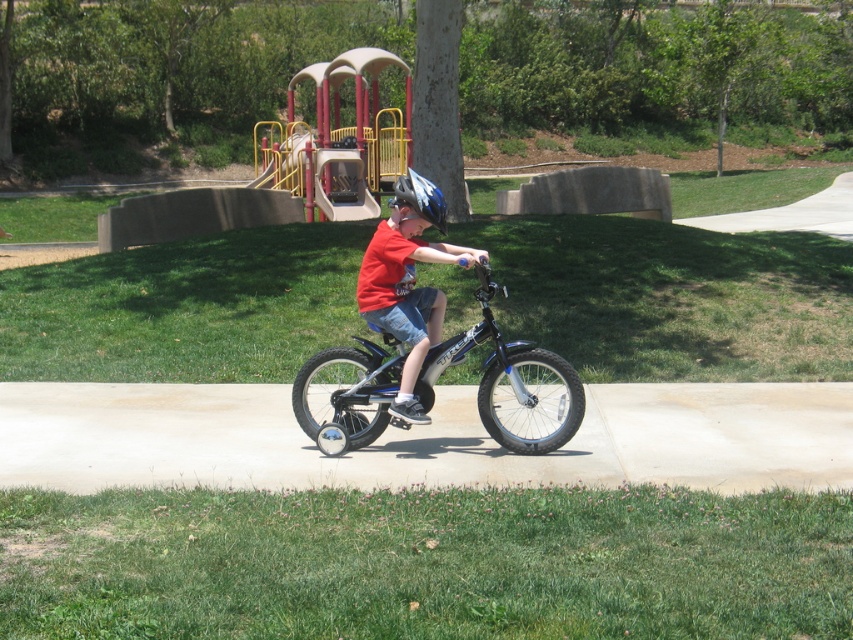
You are a photographer trying to capture the shiny metallic bicycle at center and the matte red shirt at center in the same frame. Based on their positions, which object should you adjust your camera to focus on first to ensure both are in the frame?

Since the shiny metallic bicycle at center is to the left of the matte red shirt at center, you should focus on the shiny metallic bicycle at center first to ensure both objects are captured in the frame.

You are standing in the park and see two points marked on the ground at coordinates point (440, 348) and point (434, 204). If you want to walk towards the closer point first, which coordinate should you head to?

You should head to point (434, 204) first because it is closer to you than point (440, 348), which is further away.

Based on the scene description, where is the shiny metallic bicycle at center located in terms of its 2D coordinates?

The shiny metallic bicycle at center is located at the 2D coordinates of point (x=511, y=381).